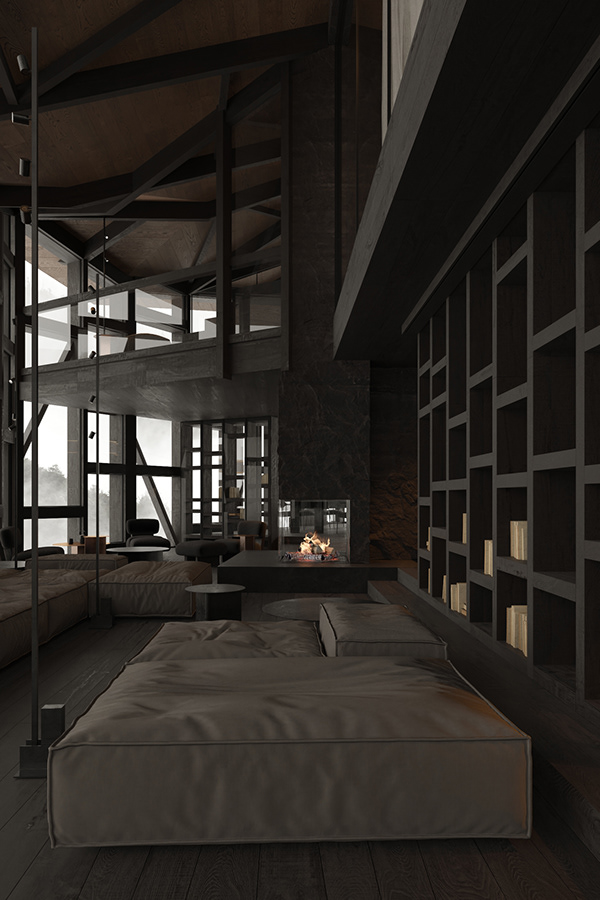
Locate an element on the screen. large shelf units is located at coordinates (532, 573), (224, 468).